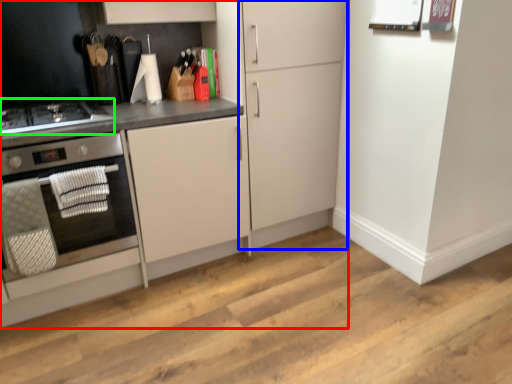
Question: Based on their relative distances, which object is nearer to cabinetry (highlighted by a red box)? Choose from cabinetry (highlighted by a blue box) and gas stove (highlighted by a green box).

Choices:
 (A) cabinetry
 (B) gas stove

Answer: (A)